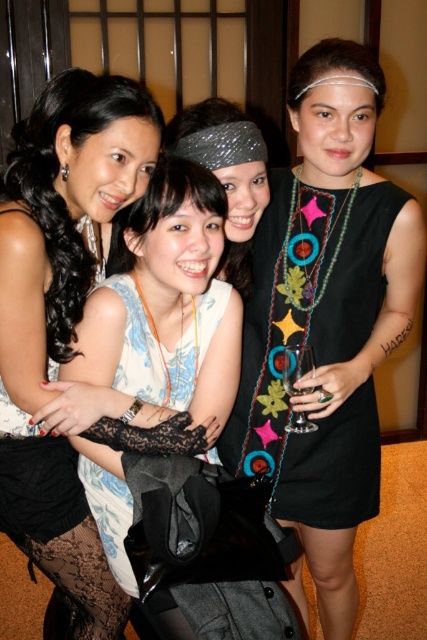
Which of these two, black fabric dress at center or white lace dress at center, stands taller?

black fabric dress at center is taller.

Does black fabric dress at center lie in front of white lace dress at center?

No, it is behind white lace dress at center.

Image resolution: width=427 pixels, height=640 pixels. Describe the element at coordinates (315, 365) in the screenshot. I see `black fabric dress at center` at that location.

This screenshot has height=640, width=427. What are the coordinates of `black fabric dress at center` in the screenshot? It's located at (315, 365).

Which is more to the right, matte black dress at center or clear glass wine glass at center?

From the viewer's perspective, clear glass wine glass at center appears more on the right side.

You are a GUI agent. You are given a task and a screenshot of the screen. Output one action in this format:
    pyautogui.click(x=<x>, y=<y>)
    Task: Click on the matte black dress at center
    
    Given the screenshot: What is the action you would take?
    pyautogui.click(x=61, y=314)

Find the location of a particular element. This screenshot has width=427, height=640. matte black dress at center is located at coordinates (61, 314).

Who is higher up, matte black dress at center or black fabric dress at center?

black fabric dress at center is higher up.

Describe the element at coordinates (61, 314) in the screenshot. I see `matte black dress at center` at that location.

The width and height of the screenshot is (427, 640). What do you see at coordinates (61, 314) in the screenshot?
I see `matte black dress at center` at bounding box center [61, 314].

The width and height of the screenshot is (427, 640). Identify the location of matte black dress at center. (61, 314).